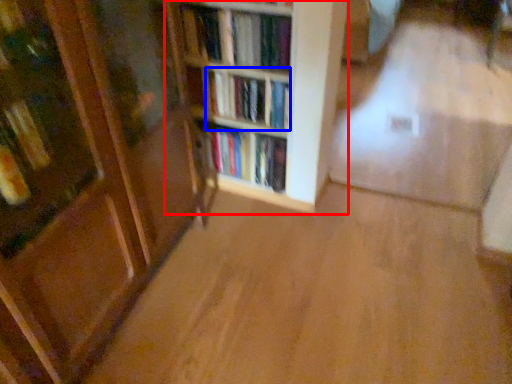
Question: Which of the following is the farthest to the observer, shelf (highlighted by a red box) or book (highlighted by a blue box)?

Choices:
 (A) shelf
 (B) book

Answer: (B)